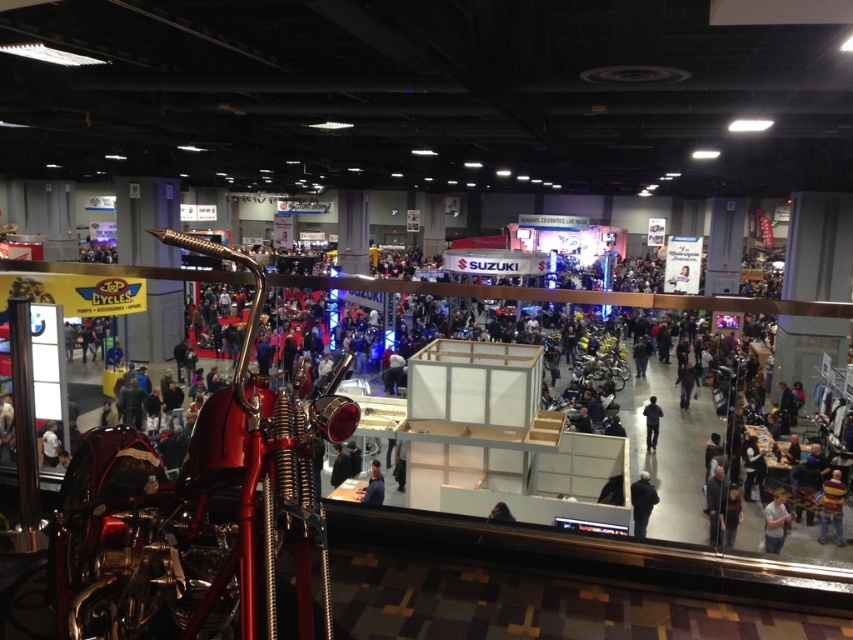
Question: Considering the real-world distances, which object is farthest from the shiny chrome motorcycle at lower left?

Choices:
 (A) dark gray fabric jacket at lower right
 (B) striped sweater at lower right

Answer: (B)

Question: Where is dark gray fabric jacket at lower right located in relation to blue fabric shirt at center in the image?

Choices:
 (A) right
 (B) left

Answer: (A)

Question: Among these objects, which one is farthest from the camera?

Choices:
 (A) dark gray fabric jacket at lower right
 (B) silhouette figure at center

Answer: (B)

Question: Based on their relative distances, which object is farther from the light blue shirt at lower right?

Choices:
 (A) silhouette figure at center
 (B) dark gray fabric jacket at lower right

Answer: (A)

Question: Is shiny chrome motorcycle at lower left below dark gray fabric jacket at lower right?

Choices:
 (A) yes
 (B) no

Answer: (A)

Question: Does striped sweater at lower right have a larger size compared to blue fabric shirt at center?

Choices:
 (A) no
 (B) yes

Answer: (B)